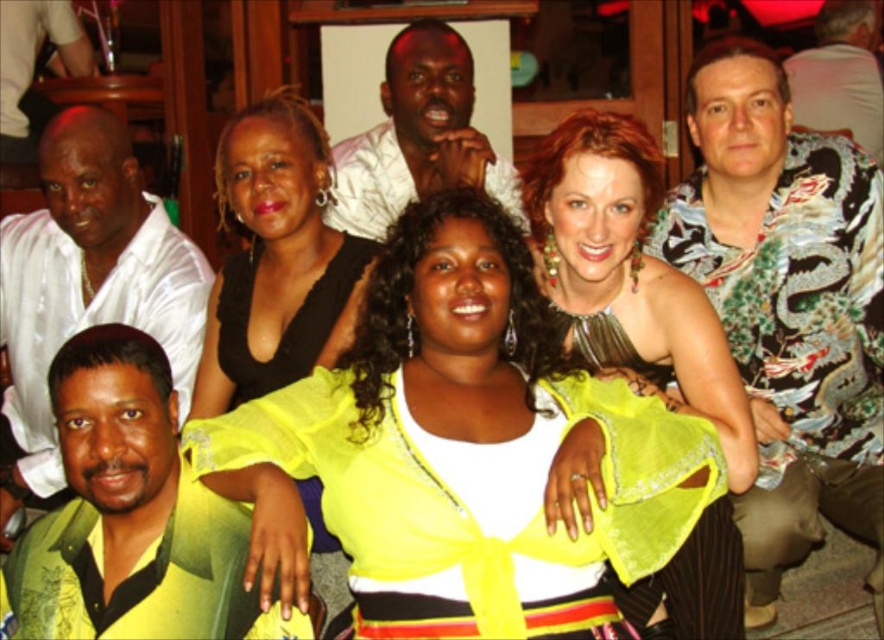
Is point (158, 560) less distant than point (59, 275)?

Yes.

Does green textured shirt at lower left have a smaller size compared to white satin shirt at upper left?

Indeed, green textured shirt at lower left has a smaller size compared to white satin shirt at upper left.

You are a GUI agent. You are given a task and a screenshot of the screen. Output one action in this format:
    pyautogui.click(x=<x>, y=<y>)
    Task: Click on the green textured shirt at lower left
    Image resolution: width=884 pixels, height=640 pixels.
    Given the screenshot: What is the action you would take?
    pyautogui.click(x=128, y=515)

Is printed silk shirt at right positioned behind shiny green fabric at center?

Yes, it is behind shiny green fabric at center.

Which is below, printed silk shirt at right or shiny green fabric at center?

printed silk shirt at right is lower down.

The width and height of the screenshot is (884, 640). What do you see at coordinates (787, 307) in the screenshot?
I see `printed silk shirt at right` at bounding box center [787, 307].

Where is `printed silk shirt at right`? Image resolution: width=884 pixels, height=640 pixels. printed silk shirt at right is located at coordinates pos(787,307).

Between shiny green fabric at center and white satin shirt at upper left, which one appears on the right side from the viewer's perspective?

shiny green fabric at center

In order to click on shiny green fabric at center in this screenshot , I will do `click(629, 276)`.

This screenshot has height=640, width=884. I want to click on shiny green fabric at center, so click(x=629, y=276).